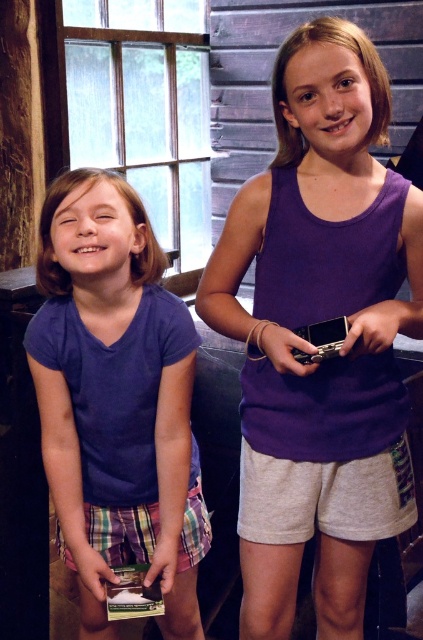
Which is behind, point (382, 86) or point (112, 540)?

Point (112, 540)

Can you confirm if purple matte tank top at center is smaller than purple cotton shirt at left?

No, purple matte tank top at center is not smaller than purple cotton shirt at left.

In order to click on purple matte tank top at center in this screenshot , I will do pos(320,320).